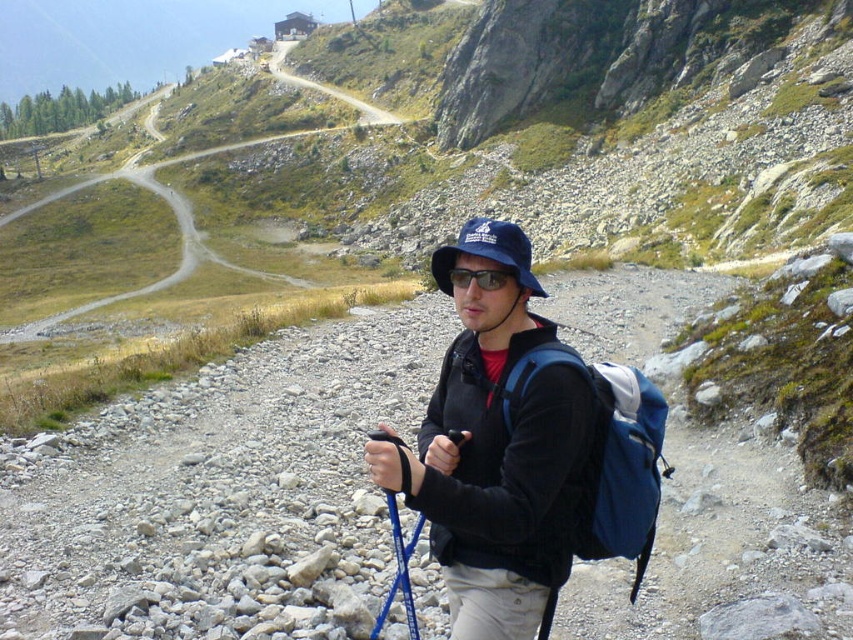
Image resolution: width=853 pixels, height=640 pixels. What do you see at coordinates (496, 451) in the screenshot? I see `matte black jacket at center` at bounding box center [496, 451].

Does matte black jacket at center have a smaller size compared to matte black sunglasses at center?

Incorrect, matte black jacket at center is not smaller in size than matte black sunglasses at center.

Does point (492, 513) lie behind point (489, 284)?

No, (492, 513) is closer to viewer.

The image size is (853, 640). Find the location of `matte black jacket at center`. matte black jacket at center is located at coordinates (496, 451).

Can you confirm if matte black jacket at center is positioned below blue fabric baseball hat at center?

Indeed, matte black jacket at center is positioned under blue fabric baseball hat at center.

Which is in front, point (523, 243) or point (444, 253)?

Point (523, 243)

Does point (509, 625) come closer to viewer compared to point (445, 276)?

Yes, point (509, 625) is in front of point (445, 276).

At what (x,y) coordinates should I click in order to perform the action: click on matte black jacket at center. Please return your answer as a coordinate pair (x, y). Looking at the image, I should click on (496, 451).

Is blue fabric backpack at center closer to the viewer compared to blue fabric baseball hat at center?

No, blue fabric backpack at center is further to the viewer.

Who is more forward, (643,433) or (519,260)?

Point (643,433) is in front.

Between point (619, 474) and point (524, 250), which one is positioned behind?

The point (524, 250) is behind.

This screenshot has width=853, height=640. I want to click on blue fabric backpack at center, so click(x=608, y=454).